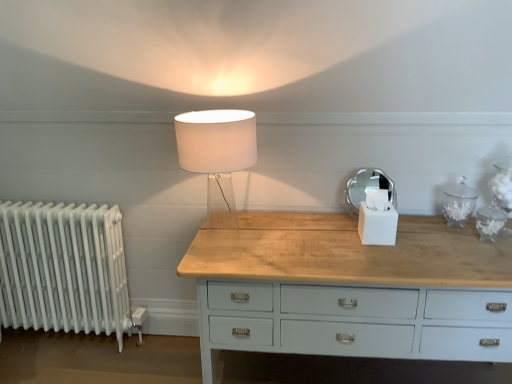
Question: Are white metallic radiator at left and translucent glass lamp at center far apart?

Choices:
 (A) no
 (B) yes

Answer: (B)

Question: Does white metallic radiator at left have a smaller size compared to translucent glass lamp at center?

Choices:
 (A) no
 (B) yes

Answer: (A)

Question: From a real-world perspective, is white metallic radiator at left on top of translucent glass lamp at center?

Choices:
 (A) yes
 (B) no

Answer: (B)

Question: From the image's perspective, is white metallic radiator at left located beneath translucent glass lamp at center?

Choices:
 (A) yes
 (B) no

Answer: (A)

Question: Considering the relative positions of white metallic radiator at left and translucent glass lamp at center in the image provided, is white metallic radiator at left to the left of translucent glass lamp at center from the viewer's perspective?

Choices:
 (A) yes
 (B) no

Answer: (A)

Question: Considering the positions of translucent glass lamp at center and white matte tissue box at center in the image, is translucent glass lamp at center wider or thinner than white matte tissue box at center?

Choices:
 (A) thin
 (B) wide

Answer: (B)

Question: From a real-world perspective, is translucent glass lamp at center above or below white matte tissue box at center?

Choices:
 (A) above
 (B) below

Answer: (A)

Question: In the image, is translucent glass lamp at center positioned in front of or behind white matte tissue box at center?

Choices:
 (A) front
 (B) behind

Answer: (A)

Question: Based on their positions, is translucent glass lamp at center located to the left or right of white matte tissue box at center?

Choices:
 (A) left
 (B) right

Answer: (A)

Question: Would you say white matte tissue box at center is to the left or to the right of translucent glass lamp at center in the picture?

Choices:
 (A) left
 (B) right

Answer: (B)

Question: Considering their positions, is white matte tissue box at center located in front of or behind translucent glass lamp at center?

Choices:
 (A) front
 (B) behind

Answer: (B)

Question: From the image's perspective, is white matte tissue box at center above or below translucent glass lamp at center?

Choices:
 (A) below
 (B) above

Answer: (A)

Question: From a real-world perspective, relative to translucent glass lamp at center, is white matte tissue box at center vertically above or below?

Choices:
 (A) below
 (B) above

Answer: (A)

Question: From a real-world perspective, relative to white metallic radiator at left, is translucent glass lamp at center vertically above or below?

Choices:
 (A) below
 (B) above

Answer: (B)

Question: Is point [x=234, y=117] positioned closer to the camera than point [x=4, y=294]?

Choices:
 (A) closer
 (B) farther

Answer: (A)